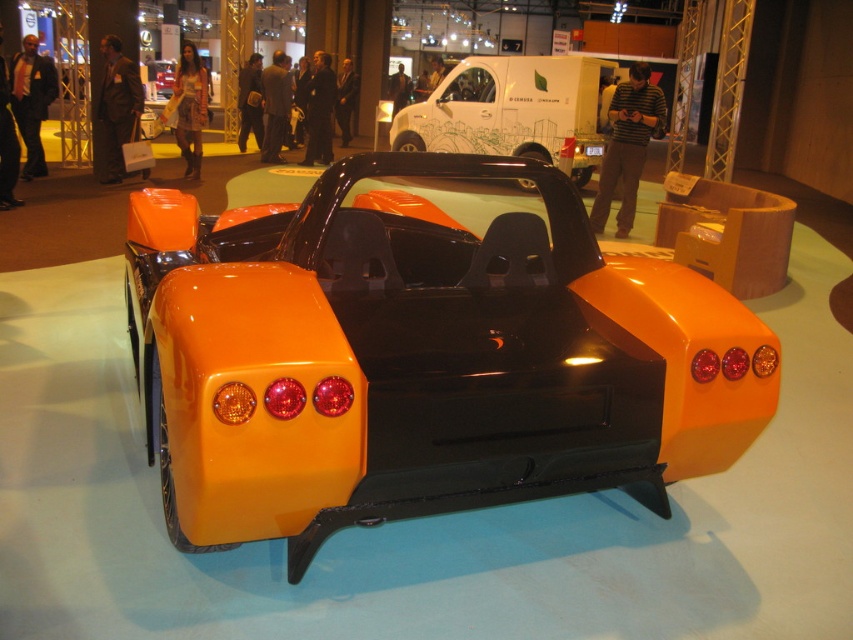
You are standing at the exhibition and want to take a photo of the glossy orange car at center. If you are 6.68 feet away from it, is this distance considered close enough for a clear, detailed photo without zoom?

The glossy orange car at center is 6.68 feet away from the viewer. This distance is generally close enough for a clear, detailed photo without needing zoom, as most cameras can capture sharp images at this range under typical lighting conditions.

You are standing at the exhibition and want to take a photo of the futuristic car. You notice two points marked on the car, one at point (283, 432) and the other at point (491, 150). Which point is closer to your camera position?

Point (283, 432) is closer to the camera than point (491, 150), so the point at (283, 432) is closer to your camera position.

You are attending an exhibition and notice the glossy orange car at center and the white glossy van at upper center. Which vehicle is located higher in the image?

The white glossy van at upper center is higher because it is positioned above the glossy orange car at center.